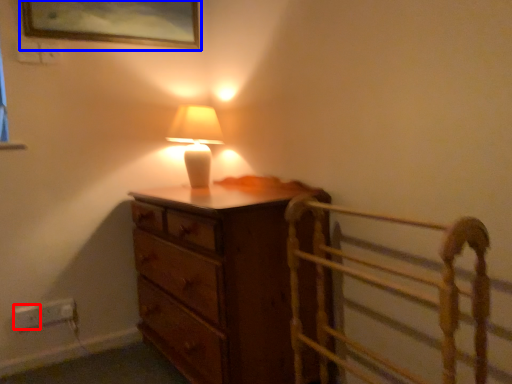
Question: Among these objects, which one is farthest to the camera, electric outlet (highlighted by a red box) or picture frame (highlighted by a blue box)?

Choices:
 (A) electric outlet
 (B) picture frame

Answer: (A)